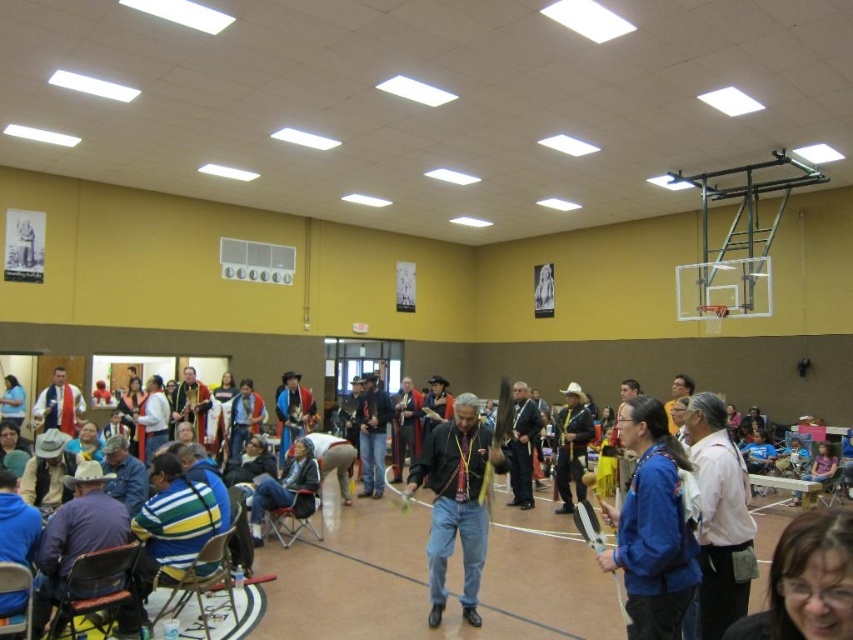
Where is `blue fabric jacket at center`? The image size is (853, 640). blue fabric jacket at center is located at coordinates (653, 525).

Between blue fabric jacket at center and matte white robe at center, which one appears on the right side from the viewer's perspective?

blue fabric jacket at center

Describe the element at coordinates (653, 525) in the screenshot. I see `blue fabric jacket at center` at that location.

Find the location of a particular element. blue fabric jacket at center is located at coordinates (653, 525).

The width and height of the screenshot is (853, 640). What do you see at coordinates (372, 435) in the screenshot?
I see `leather jacket at center` at bounding box center [372, 435].

Is point (390, 408) in front of point (515, 492)?

No.

What are the coordinates of `leather jacket at center` in the screenshot? It's located at (372, 435).

Which is more to the right, blue striped shirt at center or leather jacket at center?

Positioned to the right is blue striped shirt at center.

Is blue striped shirt at center behind leather jacket at center?

No.

Identify the location of blue striped shirt at center. This screenshot has height=640, width=853. (426, 576).